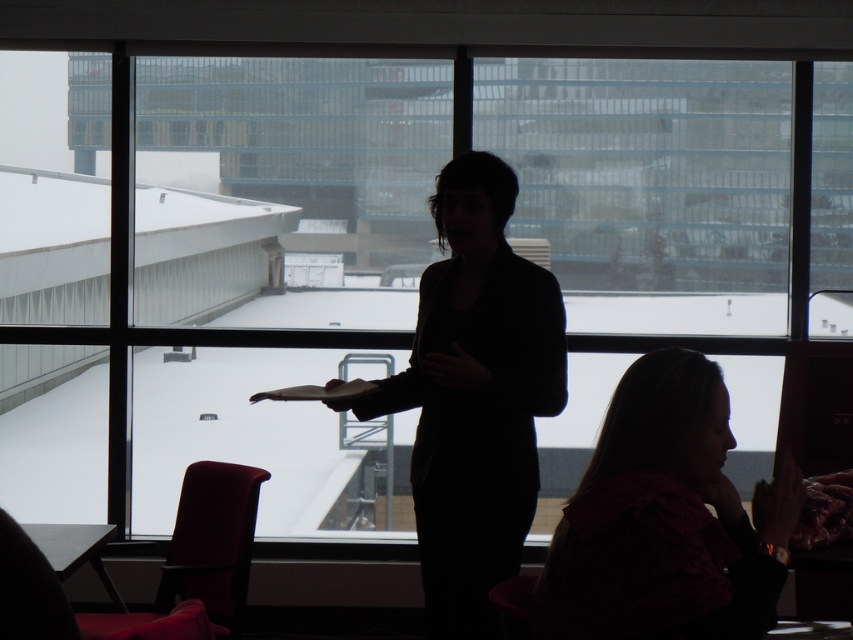
Question: Does black matte jacket at center come in front of matte pink blouse at lower right?

Choices:
 (A) yes
 (B) no

Answer: (B)

Question: Is black matte jacket at center bigger than matte pink blouse at lower right?

Choices:
 (A) no
 (B) yes

Answer: (B)

Question: Among these objects, which one is farthest from the camera?

Choices:
 (A) matte pink blouse at lower right
 (B) black matte jacket at center

Answer: (B)

Question: Does black matte jacket at center appear on the left side of matte pink blouse at lower right?

Choices:
 (A) yes
 (B) no

Answer: (A)

Question: Which point is farther to the camera?

Choices:
 (A) matte pink blouse at lower right
 (B) black matte jacket at center

Answer: (B)